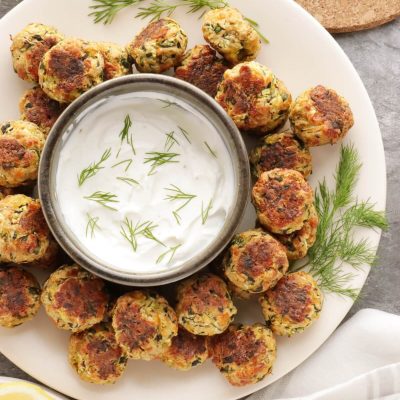
Where is `cork`? cork is located at coordinates (358, 17).